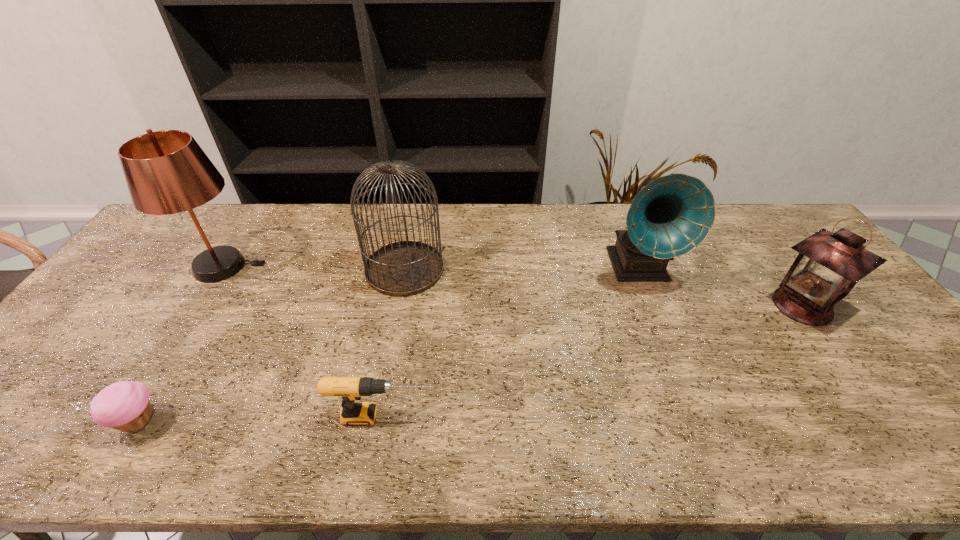
You are a GUI agent. You are given a task and a screenshot of the screen. Output one action in this format:
    pyautogui.click(x=<x>, y=<y>)
    Task: Click on the tallest object
    The image size is (960, 540).
    Given the screenshot: What is the action you would take?
    (167, 172)

Where is `birdcage`? The width and height of the screenshot is (960, 540). birdcage is located at coordinates [405, 268].

The height and width of the screenshot is (540, 960). Identify the location of the second object from right to left. (669, 217).

Locate an element on the screen. The width and height of the screenshot is (960, 540). the rightmost object is located at coordinates (828, 266).

Locate an element on the screen. Image resolution: width=960 pixels, height=540 pixels. the fourth tallest object is located at coordinates (828, 266).

Where is `the second shortest object`? the second shortest object is located at coordinates (350, 389).

The image size is (960, 540). What are the coordinates of `cupcake` in the screenshot? It's located at (125, 405).

At what (x,y) coordinates should I click in order to perform the action: click on vacant space located 0.390m on the front-facing side of the tallest object. Please return your answer as a coordinate pair (x, y). Looking at the image, I should click on (390, 267).

The width and height of the screenshot is (960, 540). I want to click on free space located 0.300m on the left of the birdcage, so click(268, 269).

Find the location of a particular element. This screenshot has width=960, height=540. blank space located 0.240m from the horn of the phonograph_record is located at coordinates (678, 367).